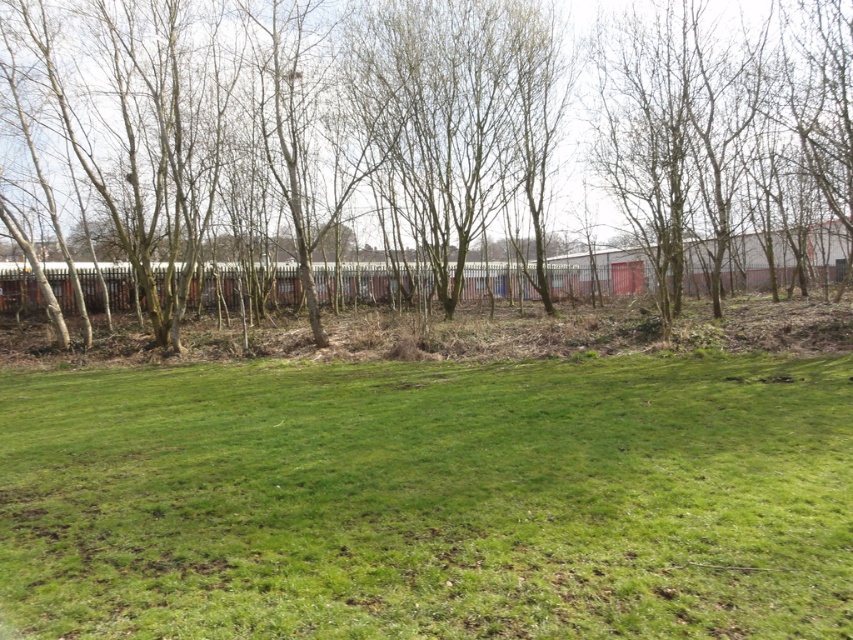
You are standing on the green grassy field at lower center and want to walk towards the bare wood trees at center. Which direction should you move to reach them?

You should move upward towards the bare wood trees at center because the green grassy field at lower center is located below them.

You are standing at the edge of the scene and want to walk towards the green grassy field at lower center and the bare wood trees at center. Which object will you encounter first?

You will encounter the green grassy field at lower center first because it is closer to you than the bare wood trees at center.